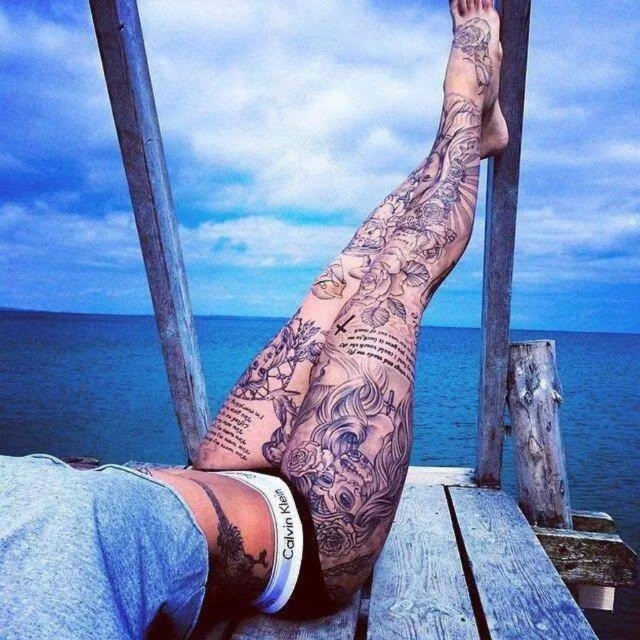
Question: Considering the relative positions of transparent water at lower center and black tattooed arm at upper center in the image provided, where is transparent water at lower center located with respect to black tattooed arm at upper center?

Choices:
 (A) left
 (B) right

Answer: (B)

Question: Which object appears farthest from the camera in this image?

Choices:
 (A) transparent water at lower center
 (B) black tattooed arm at upper center

Answer: (A)

Question: Does transparent water at lower center have a smaller size compared to black tattooed arm at upper center?

Choices:
 (A) no
 (B) yes

Answer: (B)

Question: Where is transparent water at lower center located in relation to black tattooed arm at upper center in the image?

Choices:
 (A) above
 (B) below

Answer: (B)

Question: Which of the following is the closest to the observer?

Choices:
 (A) black tattooed arm at upper center
 (B) transparent water at lower center

Answer: (A)